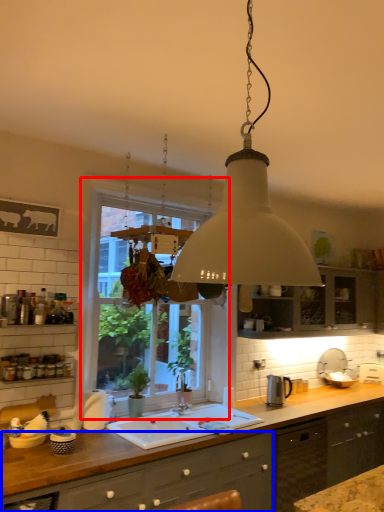
Question: Which point is further to the camera, window (highlighted by a red box) or cabinetry (highlighted by a blue box)?

Choices:
 (A) window
 (B) cabinetry

Answer: (A)